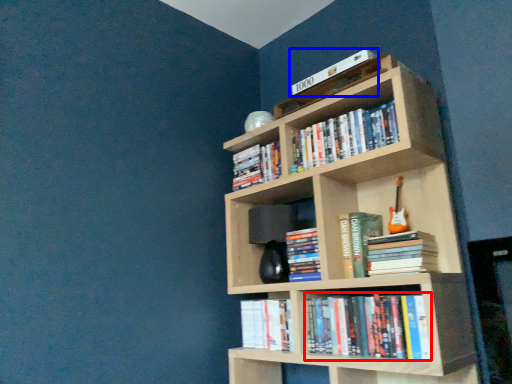
Question: Which object appears closest to the camera in this image, book (highlighted by a red box) or book (highlighted by a blue box)?

Choices:
 (A) book
 (B) book

Answer: (A)